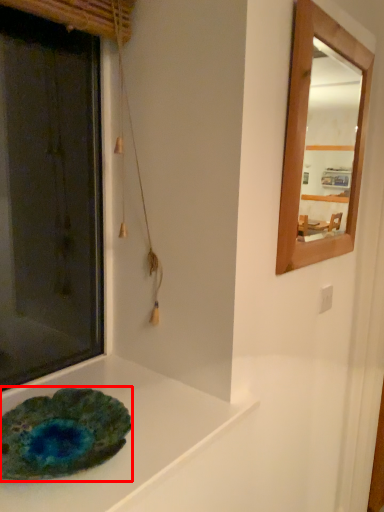
Question: From the image, what is the correct spatial relationship of glass plate (annotated by the red box) in relation to counter top?

Choices:
 (A) left
 (B) right

Answer: (A)